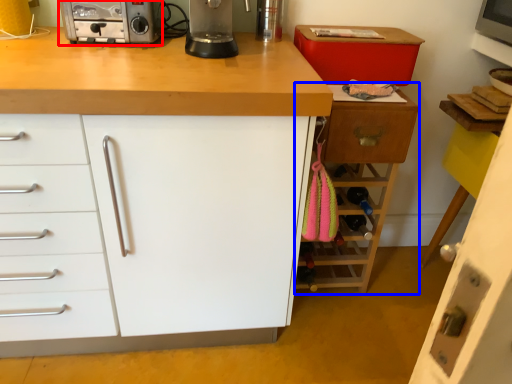
Question: Which of the following is the closest to the observer, home appliance (highlighted by a red box) or cabinetry (highlighted by a blue box)?

Choices:
 (A) home appliance
 (B) cabinetry

Answer: (A)